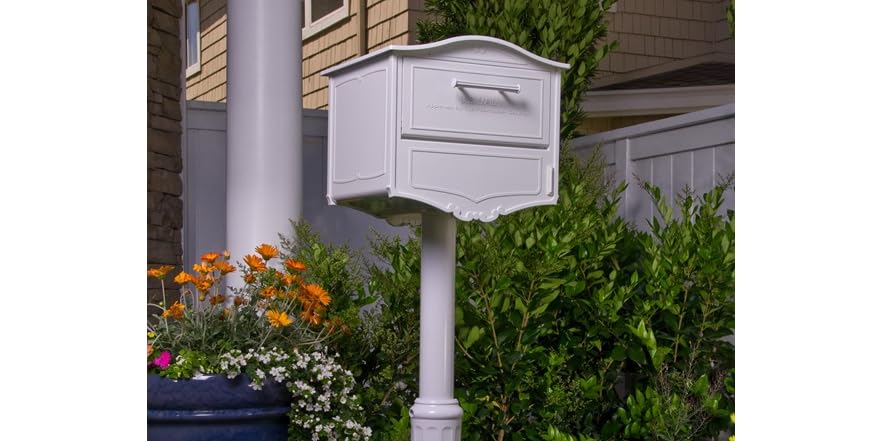
Find the location of a particular element. Image resolution: width=882 pixels, height=441 pixels. tall white wall is located at coordinates (227, 129), (218, 158), (340, 237).